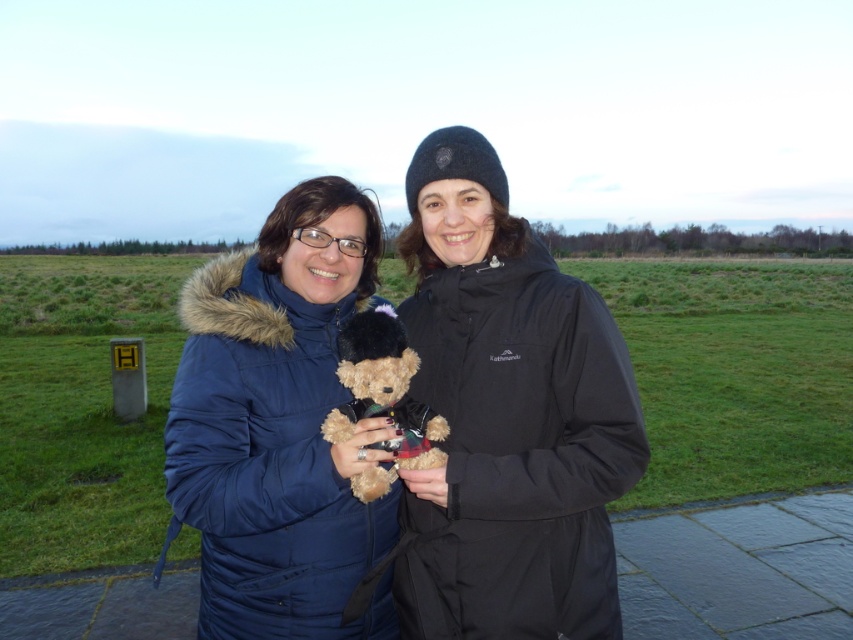
You are standing 1.5 meters tall and want to reach the black softshell jacket at center. Can you touch it without moving your feet?

The black softshell jacket at center and the viewer are 1.37 meters apart. Since the distance is less than your height of 1.5 meters, you can touch it without moving your feet.

You are standing in a grassy field and want to take a photo of the point at coordinates (460,314). If you are currently 5.38 feet away from it, should you move closer or farther away to ensure it fills the frame properly?

The point at coordinates (460,314) is 5.38 feet from the camera. To ensure it fills the frame properly, you should move closer if it appears too small or farther away if it appears too large, but since the distance is already specified, adjust based on desired framing.